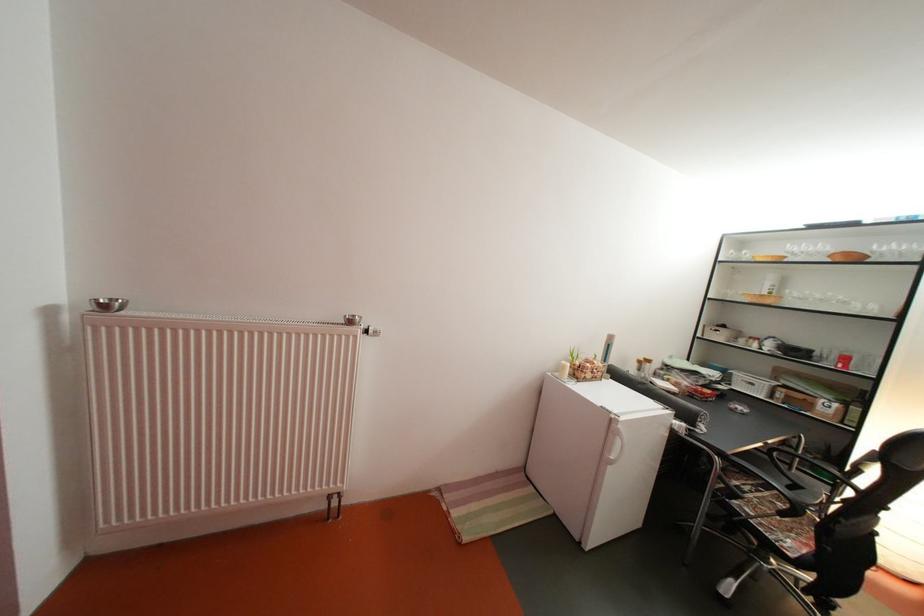
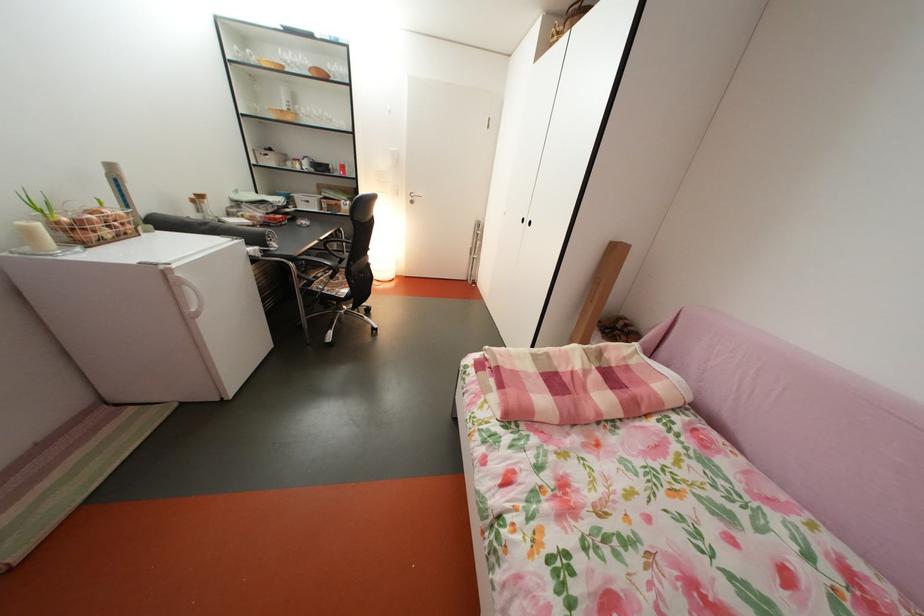
Locate, in the second image, the point that corresponds to pixel 730 342 in the first image.

(283, 168)